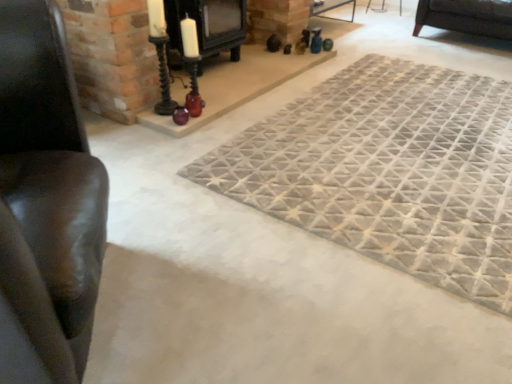
Question: From a real-world perspective, is leather couch at left positioned under textured gray mat at center based on gravity?

Choices:
 (A) yes
 (B) no

Answer: (B)

Question: Is leather couch at left wider than textured gray mat at center?

Choices:
 (A) yes
 (B) no

Answer: (B)

Question: From the image's perspective, is leather couch at left over textured gray mat at center?

Choices:
 (A) no
 (B) yes

Answer: (A)

Question: Is leather couch at left facing away from textured gray mat at center?

Choices:
 (A) yes
 (B) no

Answer: (B)

Question: Could you tell me if leather couch at left is turned towards textured gray mat at center?

Choices:
 (A) yes
 (B) no

Answer: (A)

Question: Is leather couch at left to the right of textured gray mat at center from the viewer's perspective?

Choices:
 (A) no
 (B) yes

Answer: (A)

Question: Can you confirm if leather couch at left is positioned to the left of black matte fireplace at upper center?

Choices:
 (A) no
 (B) yes

Answer: (B)

Question: Is leather couch at left oriented towards black matte fireplace at upper center?

Choices:
 (A) no
 (B) yes

Answer: (A)

Question: Considering the relative positions of leather couch at left and black matte fireplace at upper center in the image provided, is leather couch at left in front of black matte fireplace at upper center?

Choices:
 (A) no
 (B) yes

Answer: (B)

Question: Is leather couch at left not close to black matte fireplace at upper center?

Choices:
 (A) yes
 (B) no

Answer: (A)

Question: Is leather couch at left positioned with its back to black matte fireplace at upper center?

Choices:
 (A) no
 (B) yes

Answer: (A)

Question: Does leather couch at left appear on the right side of black matte fireplace at upper center?

Choices:
 (A) no
 (B) yes

Answer: (A)

Question: Considering the relative sizes of black matte fireplace at upper center and leather couch at left in the image provided, is black matte fireplace at upper center thinner than leather couch at left?

Choices:
 (A) yes
 (B) no

Answer: (A)